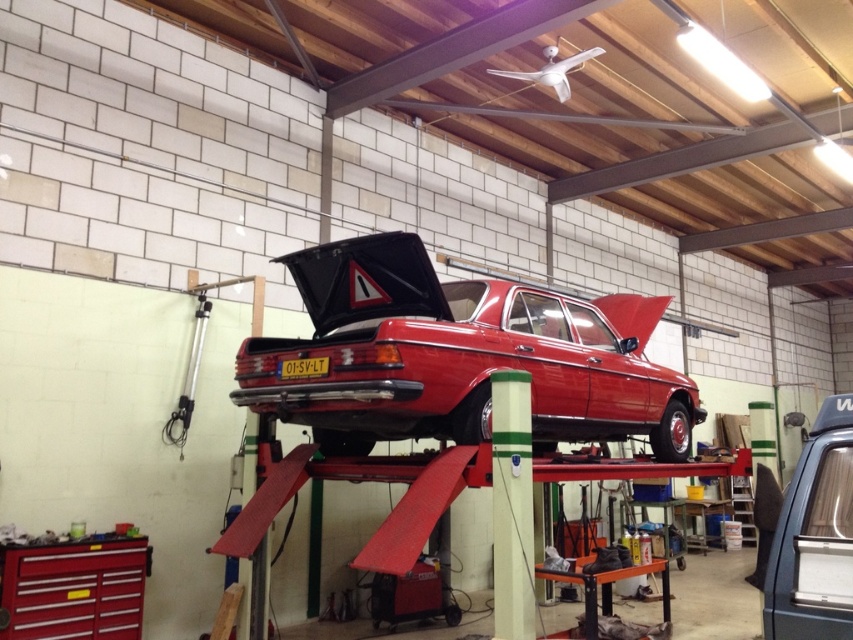
You are a mechanic working in the garage. You need to access the engine of the metallic gray car at center. Can you do so without moving the glossy red car at center?

The metallic gray car at center is behind the glossy red car at center, so you cannot access its engine without moving the glossy red car at center first.

You are a mechanic working in the garage and need to access the engine of the metallic gray car at center. Can you easily reach it while the glossy red car at center is elevated on the hydraulic lift?

The glossy red car at center is above the metallic gray car at center, so the metallic gray car at center is positioned lower. Since the glossy red car is elevated, the metallic gray car at center should still be accessible for engine work as it is not obstructed by the elevated car.

You are a mechanic working in the garage and need to determine which car is taller between the glossy red car at center and the metallic gray car at center. Based on the scene, which one is taller?

The glossy red car at center is much taller than the metallic gray car at center.